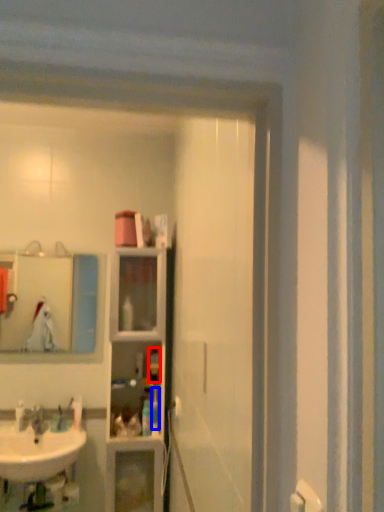
Question: Which point is further to the camera, toiletry (highlighted by a red box) or toiletry (highlighted by a blue box)?

Choices:
 (A) toiletry
 (B) toiletry

Answer: (A)